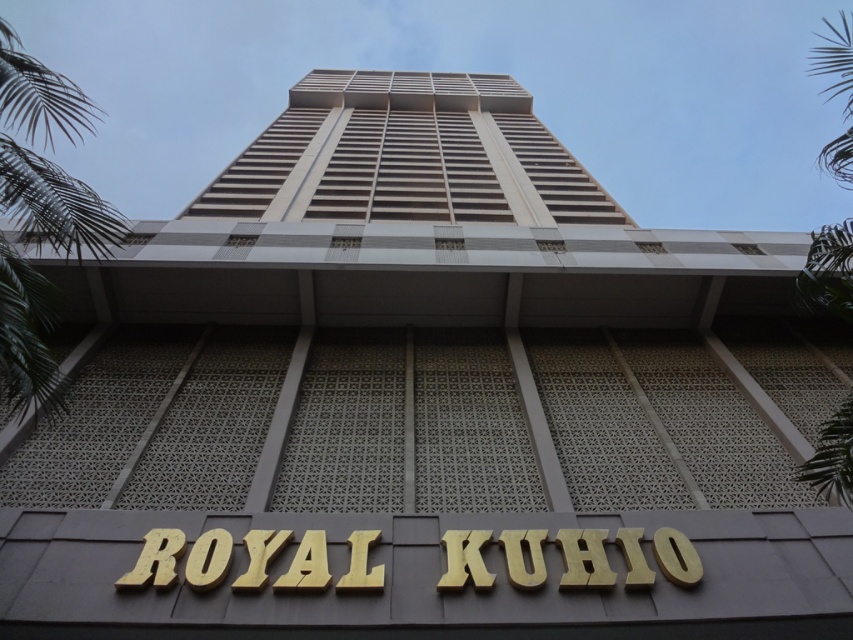
You are standing in front of the beige concrete building at center and want to take a photo of the green leafy palm tree at left. Since the building is in the way, can you still see the palm tree in your photo?

The beige concrete building at center is above the green leafy palm tree at left, so yes, you can still see the palm tree in your photo because it is positioned below the building.